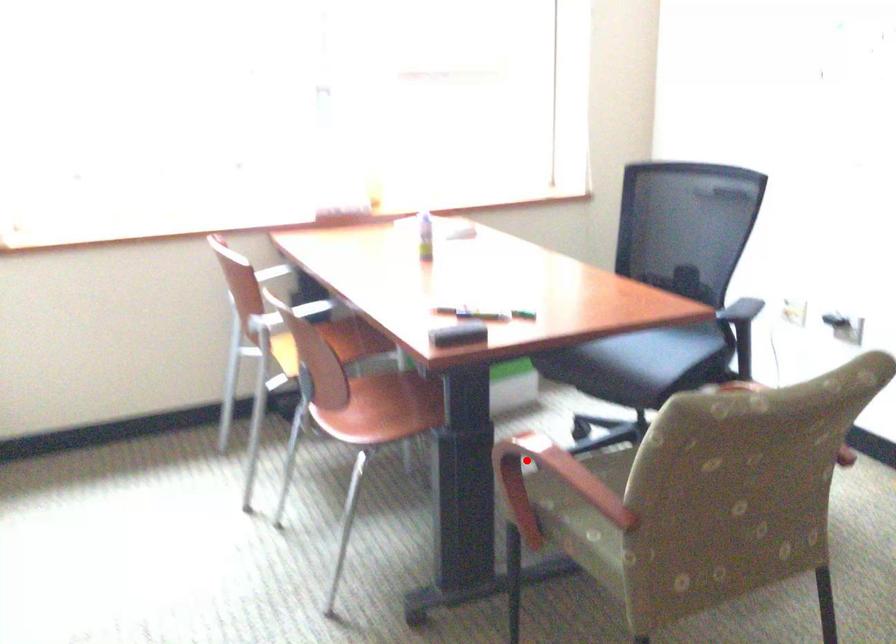
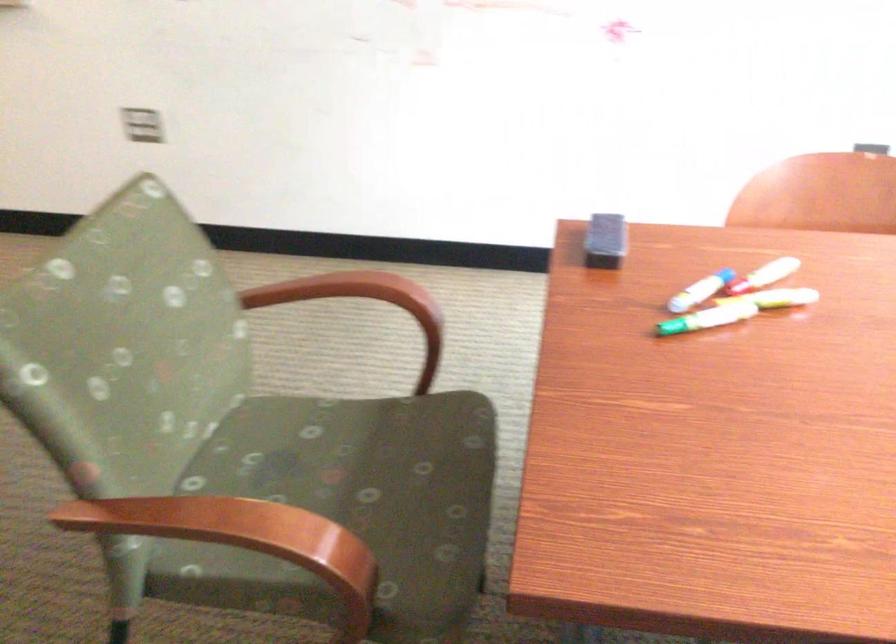
Find the pixel in the second image that matches the highlighted location in the first image.

(346, 290)